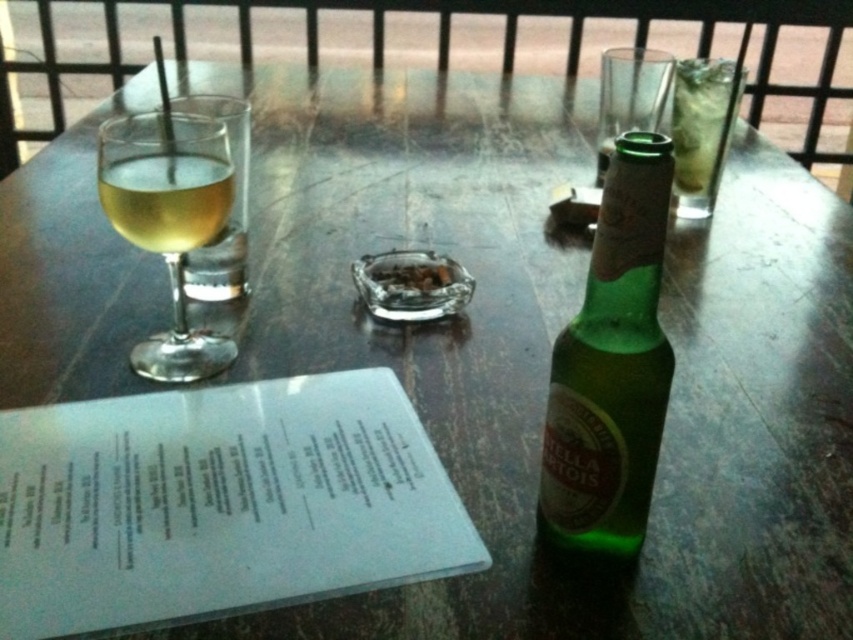
You are organizing items on a wooden table. You have a white paper menu at lower left and a translucent glass at left. Which item is wider?

The white paper menu at lower left is wider than the translucent glass at left.